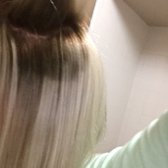
Locate an element on the screen. This screenshot has height=168, width=168. wall is located at coordinates (122, 87).